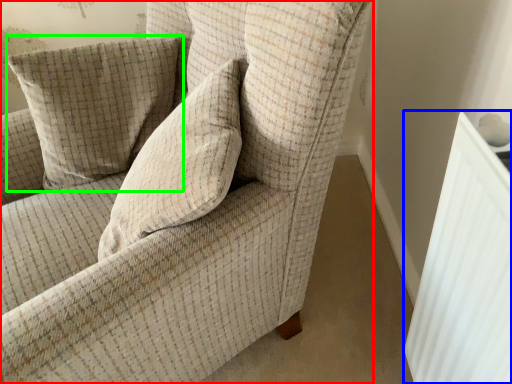
Question: Considering the real-world distances, which object is farthest from chair (highlighted by a red box)? radiator (highlighted by a blue box) or pillow (highlighted by a green box)?

Choices:
 (A) radiator
 (B) pillow

Answer: (A)